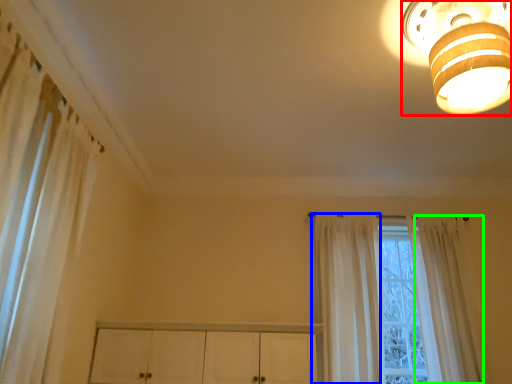
Question: Which is nearer to the lamp (highlighted by a red box)? curtain (highlighted by a blue box) or curtain (highlighted by a green box).

Choices:
 (A) curtain
 (B) curtain

Answer: (A)